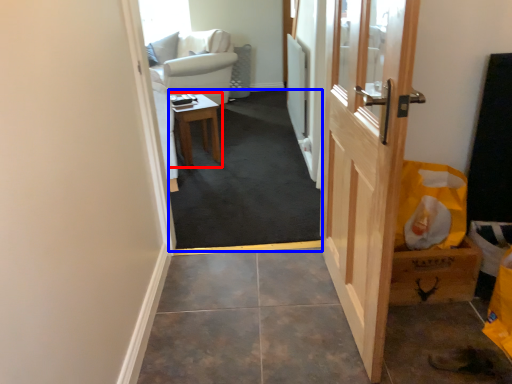
Question: Among these objects, which one is nearest to the camera, table (highlighted by a red box) or corridor (highlighted by a blue box)?

Choices:
 (A) table
 (B) corridor

Answer: (B)